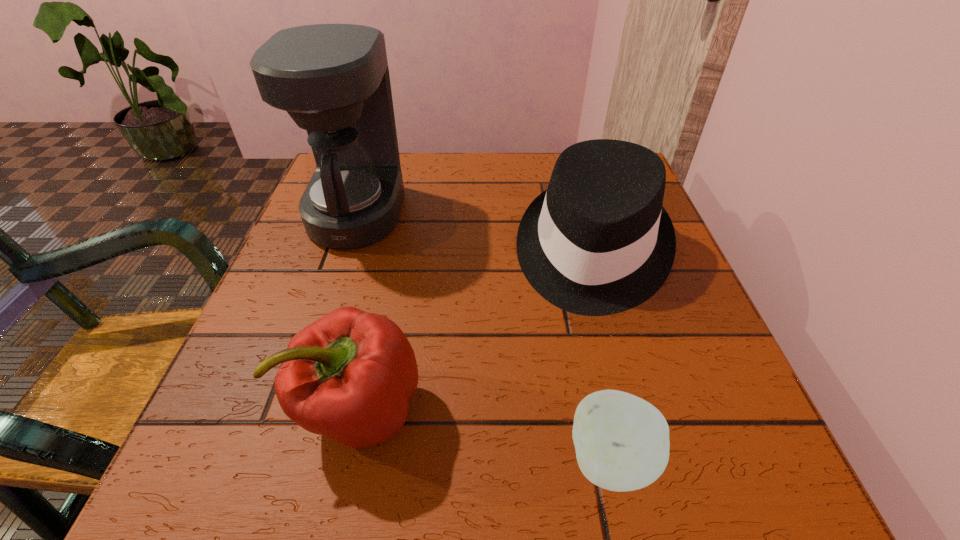
Image resolution: width=960 pixels, height=540 pixels. In the image, there is a desktop. In order to click on vacant space at the far edge in this screenshot , I will do `click(499, 157)`.

Where is `free region at the near edge of the desktop`? The image size is (960, 540). free region at the near edge of the desktop is located at coordinates (445, 475).

Image resolution: width=960 pixels, height=540 pixels. In the image, there is a desktop. Identify the location of vacant space at the left edge. (332, 255).

You are a GUI agent. You are given a task and a screenshot of the screen. Output one action in this format:
    pyautogui.click(x=<x>, y=<y>)
    Task: Click on the vacant area at the right edge
    
    Given the screenshot: What is the action you would take?
    pyautogui.click(x=682, y=430)

The image size is (960, 540). I want to click on vacant point at the near left corner, so click(x=269, y=488).

Find the location of a particular element. This screenshot has height=540, width=960. free region at the near right corner of the desktop is located at coordinates (749, 443).

Where is `unoccupied position between the coffee maker and the apple`? unoccupied position between the coffee maker and the apple is located at coordinates (485, 337).

I want to click on free space between the bell pepper and the shortest object, so click(x=487, y=435).

The width and height of the screenshot is (960, 540). What are the coordinates of `blank region between the shortest object and the tallest object` in the screenshot? It's located at (485, 337).

Image resolution: width=960 pixels, height=540 pixels. I want to click on vacant point located between the bell pepper and the apple, so click(487, 435).